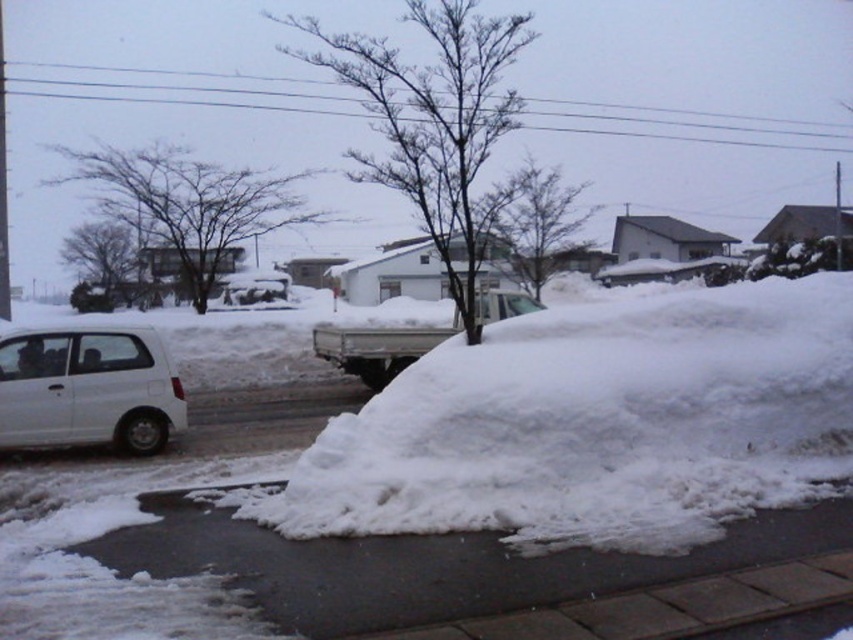
Question: Among these objects, which one is farthest from the camera?

Choices:
 (A) white matte truck at center
 (B) white matte van at left
 (C) white fluffy snow at center
 (D) white snow at lower center

Answer: (A)

Question: Is the position of white snow at lower center less distant than that of white matte truck at center?

Choices:
 (A) no
 (B) yes

Answer: (B)

Question: Among these points, which one is farthest from the camera?

Choices:
 (A) (410, 628)
 (B) (709, 388)
 (C) (111, 422)

Answer: (C)

Question: Which point appears farthest from the camera in this image?

Choices:
 (A) (495, 307)
 (B) (677, 353)
 (C) (323, 548)

Answer: (A)

Question: Is white fluffy snow at center wider than white matte truck at center?

Choices:
 (A) no
 (B) yes

Answer: (A)

Question: Does white matte van at left appear over white matte truck at center?

Choices:
 (A) no
 (B) yes

Answer: (A)